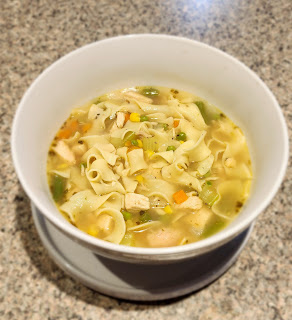
This screenshot has width=292, height=320. Identify the location of 1 color on bowl. (268, 177).